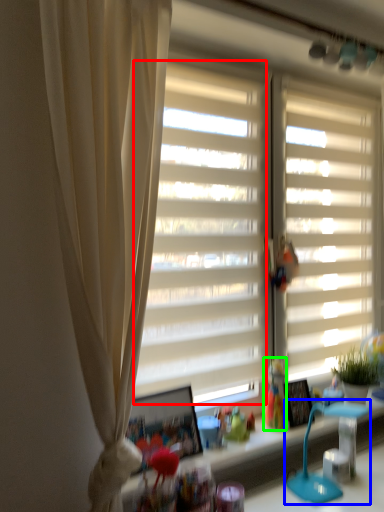
Question: Estimate the real-world distances between objects in this image. Which object is closer to window screen (highlighted by a red box), table lamp (highlighted by a blue box) or toy (highlighted by a green box)?

Choices:
 (A) table lamp
 (B) toy

Answer: (B)